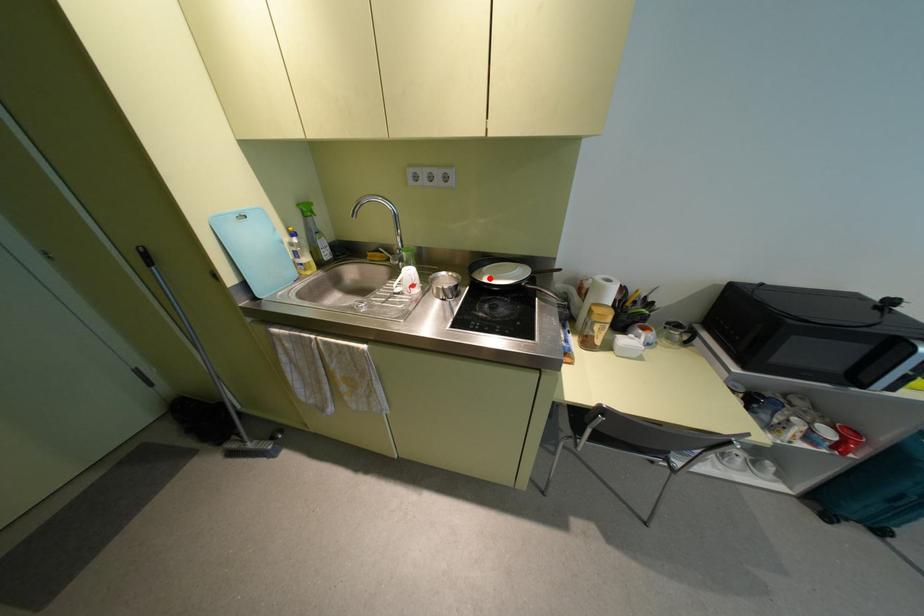
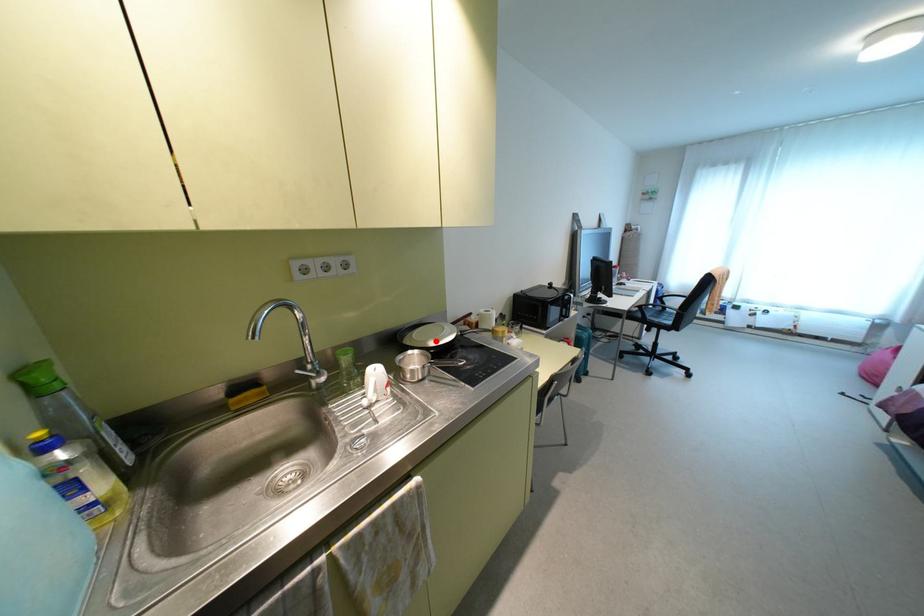
I am providing you with two images of the same scene from different viewpoints. A red point is marked on the first image and another point is marked on the second image. Are the points marked in image1 and image2 representing the same 3D position?

Yes